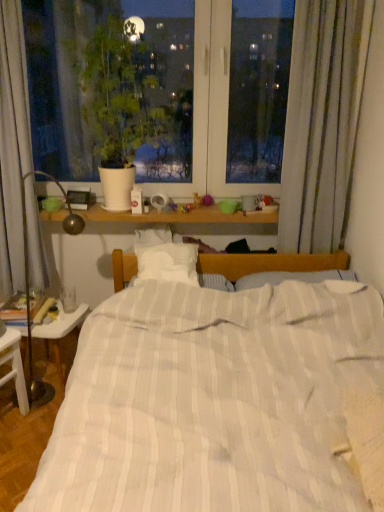
The image size is (384, 512). In order to click on white striped bed at center in this screenshot , I will do `click(212, 400)`.

Measure the distance between point (122, 148) and camera.

Point (122, 148) and camera are 7.20 feet apart from each other.

Find the location of a particular element. The width and height of the screenshot is (384, 512). white glossy table at lower left is located at coordinates (60, 332).

Which point is more distant from viewer, [44,334] or [2,385]?

The point [44,334] is more distant.

From a real-world perspective, who is located higher, white glossy table at lower left or white plastic nightstand at lower left?

In real-world perspective, white plastic nightstand at lower left is above.

Is white plastic nightstand at lower left at the back of white glossy table at lower left?

No, white glossy table at lower left is not facing the opposite direction of white plastic nightstand at lower left.

Can you confirm if green matte plant at upper left is smaller than white striped bed at center?

Indeed, green matte plant at upper left has a smaller size compared to white striped bed at center.

From a real-world perspective, is green matte plant at upper left located higher than white striped bed at center?

Correct, in the physical world, green matte plant at upper left is higher than white striped bed at center.

Which object is positioned more to the left, green matte plant at upper left or white striped bed at center?

From the viewer's perspective, green matte plant at upper left appears more on the left side.

From a real-world perspective, who is located lower, green matte plant at upper left or white glossy table at lower left?

white glossy table at lower left is physically lower.

Considering the sizes of objects green matte plant at upper left and white glossy table at lower left in the image provided, who is thinner, green matte plant at upper left or white glossy table at lower left?

Thinner between the two is white glossy table at lower left.

Does green matte plant at upper left have a greater height compared to white glossy table at lower left?

Yes.

Based on their sizes in the image, would you say white striped bed at center is bigger or smaller than white glossy table at lower left?

Considering their sizes, white striped bed at center takes up more space than white glossy table at lower left.

How many degrees apart are the facing directions of white striped bed at center and white glossy table at lower left?

79.1 degrees.

There is a white glossy table at lower left. Identify the location of bed above it (from a real-world perspective). (212, 400).

From their relative heights in the image, would you say white striped bed at center is taller or shorter than white glossy table at lower left?

Considering their sizes, white striped bed at center has more height than white glossy table at lower left.

Which of these two, green matte plant at upper left or white plastic nightstand at lower left, stands taller?

With more height is green matte plant at upper left.

From a real-world perspective, is green matte plant at upper left beneath white plastic nightstand at lower left?

No, from a real-world perspective, green matte plant at upper left is not below white plastic nightstand at lower left.

From the image's perspective, which is below, green matte plant at upper left or white plastic nightstand at lower left?

white plastic nightstand at lower left appears lower in the image.

Which is in front, point (115, 125) or point (21, 392)?

The point (21, 392) is closer to the camera.

Which point is more forward, (x=7, y=360) or (x=82, y=303)?

The point (x=7, y=360) is more forward.

Is white plastic nightstand at lower left spatially inside white glossy table at lower left, or outside of it?

white plastic nightstand at lower left is located beyond the bounds of white glossy table at lower left.

From the image's perspective, relative to white glossy table at lower left, is white plastic nightstand at lower left above or below?

white plastic nightstand at lower left is situated lower than white glossy table at lower left in the image.

Between white plastic nightstand at lower left and green matte plant at upper left, which one is positioned behind?

Positioned behind is green matte plant at upper left.

Looking at the image, does white plastic nightstand at lower left seem bigger or smaller compared to green matte plant at upper left?

In the image, white plastic nightstand at lower left appears to be smaller than green matte plant at upper left.

Would you say white plastic nightstand at lower left is to the left or to the right of green matte plant at upper left in the picture?

Clearly, white plastic nightstand at lower left is on the left of green matte plant at upper left in the image.

Can you confirm if white plastic nightstand at lower left is thinner than green matte plant at upper left?

Yes.

You are a GUI agent. You are given a task and a screenshot of the screen. Output one action in this format:
    pyautogui.click(x=<x>, y=<y>)
    Task: Click on the table behind the white plastic nightstand at lower left
    
    Given the screenshot: What is the action you would take?
    pyautogui.click(x=60, y=332)

You are a GUI agent. You are given a task and a screenshot of the screen. Output one action in this format:
    pyautogui.click(x=<x>, y=<y>)
    Task: Click on the bed in front of the green matte plant at upper left
    
    Given the screenshot: What is the action you would take?
    pyautogui.click(x=212, y=400)

Based on their spatial positions, is white plastic nightstand at lower left or green matte plant at upper left closer to white striped bed at center?

Based on the image, white plastic nightstand at lower left appears to be nearer to white striped bed at center.

Based on their spatial positions, is white striped bed at center or white glossy table at lower left further from white plastic nightstand at lower left?

The object further to white plastic nightstand at lower left is white striped bed at center.

Looking at the image, which one is located closer to green matte plant at upper left, white striped bed at center or white plastic nightstand at lower left?

white striped bed at center.

Estimate the real-world distances between objects in this image. Which object is closer to white plastic nightstand at lower left, white glossy table at lower left or white striped bed at center?

Based on the image, white glossy table at lower left appears to be nearer to white plastic nightstand at lower left.

Which object lies nearer to the anchor point green matte plant at upper left, white striped bed at center or white glossy table at lower left?

The object closer to green matte plant at upper left is white striped bed at center.

Looking at the image, which one is located closer to white glossy table at lower left, white plastic nightstand at lower left or white striped bed at center?

white plastic nightstand at lower left is positioned closer to the anchor white glossy table at lower left.

Which object lies further to the anchor point white plastic nightstand at lower left, white striped bed at center or green matte plant at upper left?

green matte plant at upper left is further to white plastic nightstand at lower left.

When comparing their distances from green matte plant at upper left, does white glossy table at lower left or white striped bed at center seem further?

white glossy table at lower left.

Where is `table that lies between green matte plant at upper left and white plastic nightstand at lower left from top to bottom`? table that lies between green matte plant at upper left and white plastic nightstand at lower left from top to bottom is located at coordinates (60, 332).

Locate an element on the screen. The image size is (384, 512). table between green matte plant at upper left and white striped bed at center from top to bottom is located at coordinates (60, 332).

You are a GUI agent. You are given a task and a screenshot of the screen. Output one action in this format:
    pyautogui.click(x=<x>, y=<y>)
    Task: Click on the bed between green matte plant at upper left and white plastic nightstand at lower left from top to bottom
    This screenshot has width=384, height=512.
    Given the screenshot: What is the action you would take?
    pyautogui.click(x=212, y=400)

Where is `nightstand between white striped bed at center and white glossy table at lower left in the front-back direction`? nightstand between white striped bed at center and white glossy table at lower left in the front-back direction is located at coordinates (14, 366).